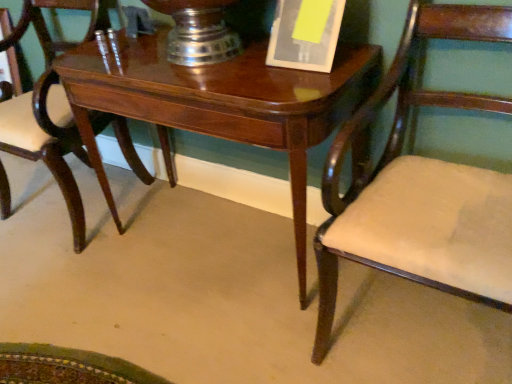
The height and width of the screenshot is (384, 512). In order to click on matte wood chair at right, arranged as the 2th chair when viewed from the left in this screenshot , I will do point(421,187).

This screenshot has width=512, height=384. I want to click on mahogany wood chair at center, acting as the second chair starting from the right, so click(x=48, y=107).

What are the coordinates of `matte wood chair at right, which appears as the first chair when viewed from the right` in the screenshot? It's located at (421, 187).

From a real-world perspective, who is located higher, matte wood chair at right, which appears as the first chair when viewed from the right, or mahogany wood chair at center, acting as the second chair starting from the right?

From a 3D spatial view, matte wood chair at right, which appears as the first chair when viewed from the right, is above.

From the image's perspective, which one is positioned higher, matte wood chair at right, arranged as the 2th chair when viewed from the left, or mahogany wood chair at center, acting as the second chair starting from the right?

mahogany wood chair at center, acting as the second chair starting from the right.

Considering the sizes of matte wood chair at right, which appears as the first chair when viewed from the right, and mahogany wood chair at center, acting as the second chair starting from the right, in the image, is matte wood chair at right, which appears as the first chair when viewed from the right, wider or thinner than mahogany wood chair at center, acting as the second chair starting from the right,?

matte wood chair at right, which appears as the first chair when viewed from the right, is wider than mahogany wood chair at center, acting as the second chair starting from the right.

Could you tell me if matte wood chair at right, arranged as the 2th chair when viewed from the left, is facing mahogany wood chair at center, acting as the second chair starting from the right?

No, matte wood chair at right, arranged as the 2th chair when viewed from the left, is not facing towards mahogany wood chair at center, acting as the second chair starting from the right.

How distant is yellow paper at upper center from matte wood chair at right, arranged as the 2th chair when viewed from the left?

yellow paper at upper center is 13.67 inches away from matte wood chair at right, arranged as the 2th chair when viewed from the left.

Is yellow paper at upper center oriented away from matte wood chair at right, arranged as the 2th chair when viewed from the left?

yellow paper at upper center does not have its back to matte wood chair at right, arranged as the 2th chair when viewed from the left.

Which of these two, yellow paper at upper center or matte wood chair at right, arranged as the 2th chair when viewed from the left, is wider?

With larger width is matte wood chair at right, arranged as the 2th chair when viewed from the left.

Is yellow paper at upper center inside or outside of matte wood chair at right, which appears as the first chair when viewed from the right?

yellow paper at upper center is located beyond the bounds of matte wood chair at right, which appears as the first chair when viewed from the right.

Is there a large distance between glossy wood table at center and matte wood chair at right, arranged as the 2th chair when viewed from the left?

No, glossy wood table at center is in close proximity to matte wood chair at right, arranged as the 2th chair when viewed from the left.

Considering the sizes of objects glossy wood table at center and matte wood chair at right, which appears as the first chair when viewed from the right, in the image provided, who is bigger, glossy wood table at center or matte wood chair at right, which appears as the first chair when viewed from the right,?

glossy wood table at center.

From the image's perspective, is glossy wood table at center beneath matte wood chair at right, arranged as the 2th chair when viewed from the left?

No, from the image's perspective, glossy wood table at center is not beneath matte wood chair at right, arranged as the 2th chair when viewed from the left.

Looking at this image, can you confirm if glossy wood table at center is taller than matte wood chair at right, which appears as the first chair when viewed from the right?

Incorrect, the height of glossy wood table at center is not larger of that of matte wood chair at right, which appears as the first chair when viewed from the right.

From a real-world perspective, is glossy wood table at center above or below yellow paper at upper center?

From a real-world perspective, glossy wood table at center is physically below yellow paper at upper center.

Can you confirm if glossy wood table at center is positioned to the left of yellow paper at upper center?

Yes, glossy wood table at center is to the left of yellow paper at upper center.

Is glossy wood table at center oriented towards yellow paper at upper center?

No, glossy wood table at center does not turn towards yellow paper at upper center.

From the image's perspective, does glossy wood table at center appear higher than mahogany wood chair at center, acting as the second chair starting from the right?

No, from the image's perspective, glossy wood table at center is not above mahogany wood chair at center, acting as the second chair starting from the right.

Do you think glossy wood table at center is within mahogany wood chair at center, marked as the 1th chair in a left-to-right arrangement, or outside of it?

glossy wood table at center is not enclosed by mahogany wood chair at center, marked as the 1th chair in a left-to-right arrangement.

Considering the sizes of objects glossy wood table at center and mahogany wood chair at center, acting as the second chair starting from the right, in the image provided, who is bigger, glossy wood table at center or mahogany wood chair at center, acting as the second chair starting from the right,?

Bigger between the two is glossy wood table at center.

Which is behind, point (1, 206) or point (288, 34)?

The point (1, 206) is farther.

Considering the sizes of objects mahogany wood chair at center, acting as the second chair starting from the right, and yellow paper at upper center in the image provided, who is thinner, mahogany wood chair at center, acting as the second chair starting from the right, or yellow paper at upper center?

yellow paper at upper center.

Are mahogany wood chair at center, acting as the second chair starting from the right, and yellow paper at upper center beside each other?

There is a gap between mahogany wood chair at center, acting as the second chair starting from the right, and yellow paper at upper center.

Considering the sizes of mahogany wood chair at center, acting as the second chair starting from the right, and yellow paper at upper center in the image, is mahogany wood chair at center, acting as the second chair starting from the right, taller or shorter than yellow paper at upper center?

mahogany wood chair at center, acting as the second chair starting from the right, is taller than yellow paper at upper center.

Based on the photo, from the image's perspective, is mahogany wood chair at center, marked as the 1th chair in a left-to-right arrangement, positioned above or below glossy wood table at center?

mahogany wood chair at center, marked as the 1th chair in a left-to-right arrangement, is above glossy wood table at center.

From a real-world perspective, is mahogany wood chair at center, acting as the second chair starting from the right, on glossy wood table at center?

Yes, from a real-world perspective, mahogany wood chair at center, acting as the second chair starting from the right, is over glossy wood table at center

Are mahogany wood chair at center, marked as the 1th chair in a left-to-right arrangement, and glossy wood table at center making contact?

mahogany wood chair at center, marked as the 1th chair in a left-to-right arrangement, is not next to glossy wood table at center, and they're not touching.

Considering the sizes of mahogany wood chair at center, marked as the 1th chair in a left-to-right arrangement, and glossy wood table at center in the image, is mahogany wood chair at center, marked as the 1th chair in a left-to-right arrangement, taller or shorter than glossy wood table at center?

In the image, mahogany wood chair at center, marked as the 1th chair in a left-to-right arrangement, appears to be taller than glossy wood table at center.

Locate an element on the screen. This screenshot has width=512, height=384. chair in front of the mahogany wood chair at center, marked as the 1th chair in a left-to-right arrangement is located at coordinates (421, 187).

Locate an element on the screen. paperback book above the matte wood chair at right, which appears as the first chair when viewed from the right (from a real-world perspective) is located at coordinates (303, 37).

When comparing their distances from mahogany wood chair at center, acting as the second chair starting from the right, does matte wood chair at right, which appears as the first chair when viewed from the right, or glossy wood table at center seem further?

Based on the image, matte wood chair at right, which appears as the first chair when viewed from the right, appears to be further to mahogany wood chair at center, acting as the second chair starting from the right.

Looking at the image, which one is located further to mahogany wood chair at center, acting as the second chair starting from the right, yellow paper at upper center or matte wood chair at right, arranged as the 2th chair when viewed from the left?

matte wood chair at right, arranged as the 2th chair when viewed from the left, is further to mahogany wood chair at center, acting as the second chair starting from the right.

From the image, which object appears to be farther from glossy wood table at center, mahogany wood chair at center, marked as the 1th chair in a left-to-right arrangement, or yellow paper at upper center?

mahogany wood chair at center, marked as the 1th chair in a left-to-right arrangement, is positioned further to the anchor glossy wood table at center.

Consider the image. Considering their positions, is matte wood chair at right, arranged as the 2th chair when viewed from the left, positioned closer to glossy wood table at center than yellow paper at upper center?

yellow paper at upper center is positioned closer to the anchor glossy wood table at center.

When comparing their distances from matte wood chair at right, which appears as the first chair when viewed from the right, does yellow paper at upper center or mahogany wood chair at center, marked as the 1th chair in a left-to-right arrangement, seem closer?

yellow paper at upper center lies closer to matte wood chair at right, which appears as the first chair when viewed from the right, than the other object.

Looking at the image, which one is located further to matte wood chair at right, which appears as the first chair when viewed from the right, mahogany wood chair at center, marked as the 1th chair in a left-to-right arrangement, or yellow paper at upper center?

Based on the image, mahogany wood chair at center, marked as the 1th chair in a left-to-right arrangement, appears to be further to matte wood chair at right, which appears as the first chair when viewed from the right.

From the image, which object appears to be farther from mahogany wood chair at center, acting as the second chair starting from the right, glossy wood table at center or yellow paper at upper center?

yellow paper at upper center lies further to mahogany wood chair at center, acting as the second chair starting from the right, than the other object.

Estimate the real-world distances between objects in this image. Which object is further from matte wood chair at right, which appears as the first chair when viewed from the right, yellow paper at upper center or glossy wood table at center?

yellow paper at upper center is further to matte wood chair at right, which appears as the first chair when viewed from the right.

In order to click on table between mahogany wood chair at center, marked as the 1th chair in a left-to-right arrangement, and yellow paper at upper center, in the horizontal direction in this screenshot , I will do `click(221, 105)`.

This screenshot has height=384, width=512. Find the location of `paperback book between mahogany wood chair at center, acting as the second chair starting from the right, and matte wood chair at right, which appears as the first chair when viewed from the right, from left to right`. paperback book between mahogany wood chair at center, acting as the second chair starting from the right, and matte wood chair at right, which appears as the first chair when viewed from the right, from left to right is located at coordinates (303, 37).

Where is `paperback book situated between glossy wood table at center and matte wood chair at right, arranged as the 2th chair when viewed from the left, from left to right`? paperback book situated between glossy wood table at center and matte wood chair at right, arranged as the 2th chair when viewed from the left, from left to right is located at coordinates (303, 37).

Image resolution: width=512 pixels, height=384 pixels. I want to click on table located between mahogany wood chair at center, acting as the second chair starting from the right, and matte wood chair at right, which appears as the first chair when viewed from the right, in the left-right direction, so click(x=221, y=105).